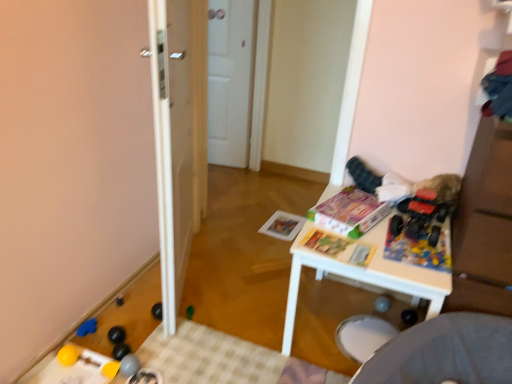
I want to click on spots to the right of matte paper magazine at center, the first magazine positioned from the front, so click(x=393, y=253).